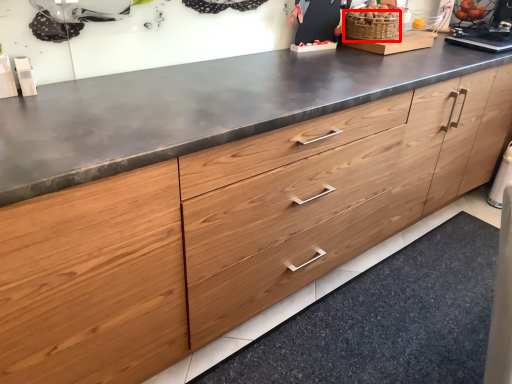
Question: In this image, where is basket (annotated by the red box) located relative to granite?

Choices:
 (A) left
 (B) right

Answer: (A)